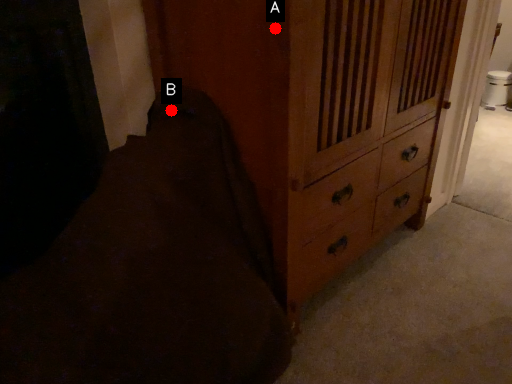
Question: Two points are circled on the image, labeled by A and B beside each circle. Which point appears farthest from the camera in this image?

Choices:
 (A) A is further
 (B) B is further

Answer: (B)